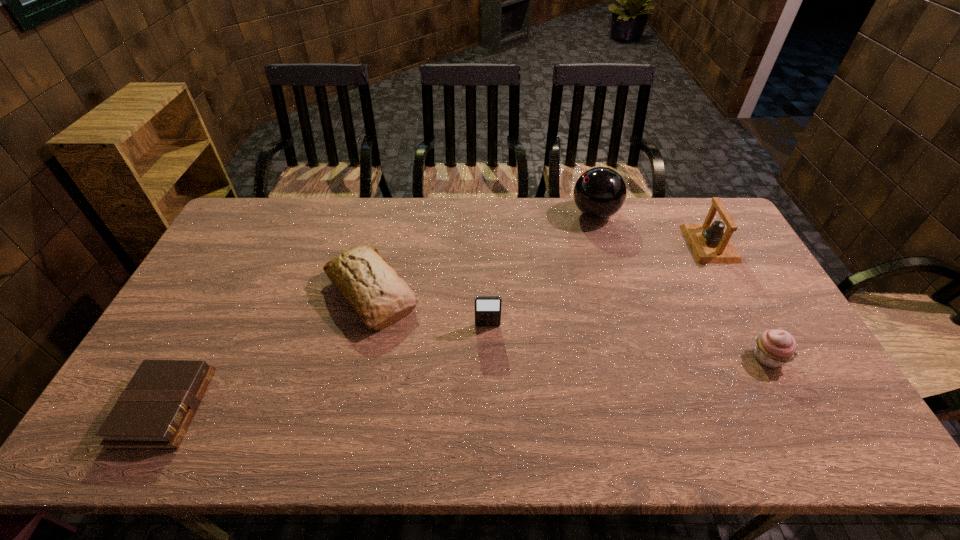
Locate an element on the screen. This screenshot has width=960, height=540. bowling ball is located at coordinates (600, 192).

This screenshot has width=960, height=540. I want to click on the tallest object, so click(x=600, y=192).

Find the location of a particular element. bell is located at coordinates [x=710, y=243].

Find the location of a particular element. This screenshot has height=540, width=960. the third object from left to right is located at coordinates (487, 308).

Identify the location of bread. This screenshot has height=540, width=960. (380, 298).

You are a GUI agent. You are given a task and a screenshot of the screen. Output one action in this format:
    pyautogui.click(x=<x>, y=<y>)
    Task: Click on the cupcake
    The height and width of the screenshot is (540, 960).
    Given the screenshot: What is the action you would take?
    pyautogui.click(x=774, y=348)

This screenshot has height=540, width=960. I want to click on the shortest object, so click(x=153, y=412).

Image resolution: width=960 pixels, height=540 pixels. In order to click on the leftmost object in this screenshot , I will do `click(153, 412)`.

Where is `vacant area situated 0.190m on the surface of the third object from right to left near the finger holes`? This screenshot has height=540, width=960. vacant area situated 0.190m on the surface of the third object from right to left near the finger holes is located at coordinates point(518,213).

Where is `vacant space located 0.310m on the surface of the third object from right to left near the finger holes`? The width and height of the screenshot is (960, 540). vacant space located 0.310m on the surface of the third object from right to left near the finger holes is located at coordinates (486, 213).